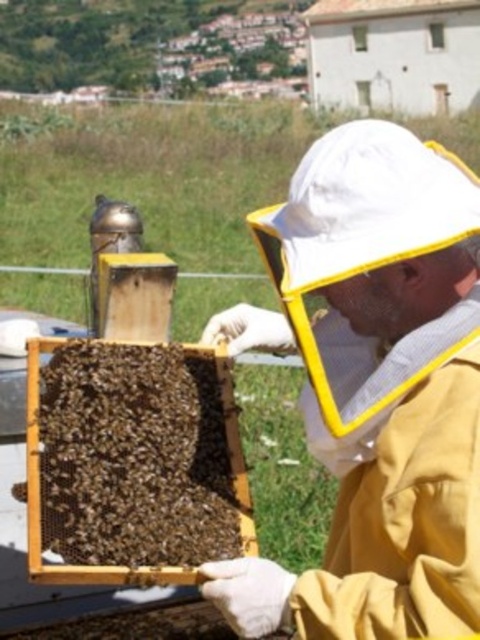
Is point (407, 170) closer to viewer compared to point (197, 378)?

Yes, it is.

Is yellow fabric beekeeper suit at center behind brown wooden beehive at center?

That is False.

At what (x,y) coordinates should I click in order to perform the action: click on yellow fabric beekeeper suit at center. Please return your answer as a coordinate pair (x, y). This screenshot has height=640, width=480. Looking at the image, I should click on (373, 387).

Find the location of a particular element. The width and height of the screenshot is (480, 640). yellow fabric beekeeper suit at center is located at coordinates (373, 387).